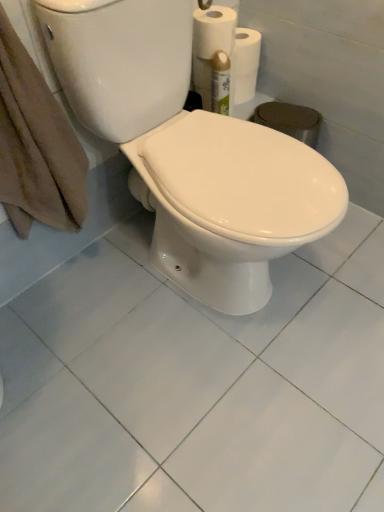
What are the coordinates of `blank space situated above white glossy ceramic tile at center (from a real-world perspective)` in the screenshot? It's located at (191, 361).